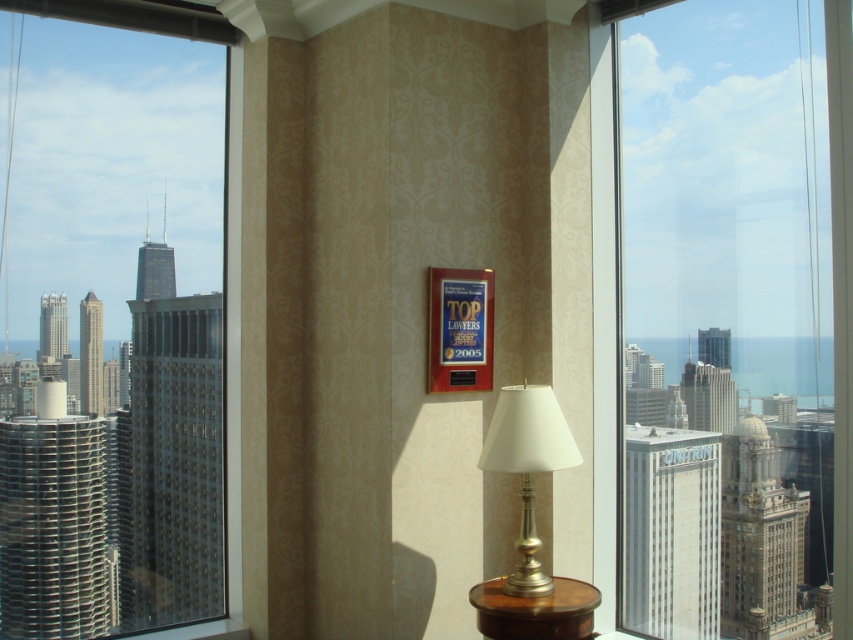
Between transparent glass window at left and brown wood table at lower center, which one appears on the right side from the viewer's perspective?

From the viewer's perspective, brown wood table at lower center appears more on the right side.

Is point (126, 125) positioned after point (526, 616)?

Yes, point (126, 125) is farther from viewer.

Locate an element on the screen. Image resolution: width=853 pixels, height=640 pixels. transparent glass window at left is located at coordinates (125, 378).

Does transparent glass window at left appear on the right side of silver metallic lamp at center?

In fact, transparent glass window at left is to the left of silver metallic lamp at center.

In the scene shown: Is transparent glass window at left behind silver metallic lamp at center?

Yes, transparent glass window at left is behind silver metallic lamp at center.

Describe the element at coordinates (125, 378) in the screenshot. I see `transparent glass window at left` at that location.

Where is `transparent glass window at left`? The image size is (853, 640). transparent glass window at left is located at coordinates (125, 378).

Who is more distant from viewer, [537,392] or [550,627]?

The point [537,392] is behind.

Is silver metallic lamp at center closer to the viewer compared to brown wood table at lower center?

That is False.

Describe the element at coordinates (527, 467) in the screenshot. This screenshot has height=640, width=853. I see `silver metallic lamp at center` at that location.

At what (x,y) coordinates should I click in order to perform the action: click on silver metallic lamp at center. Please return your answer as a coordinate pair (x, y). The width and height of the screenshot is (853, 640). Looking at the image, I should click on (527, 467).